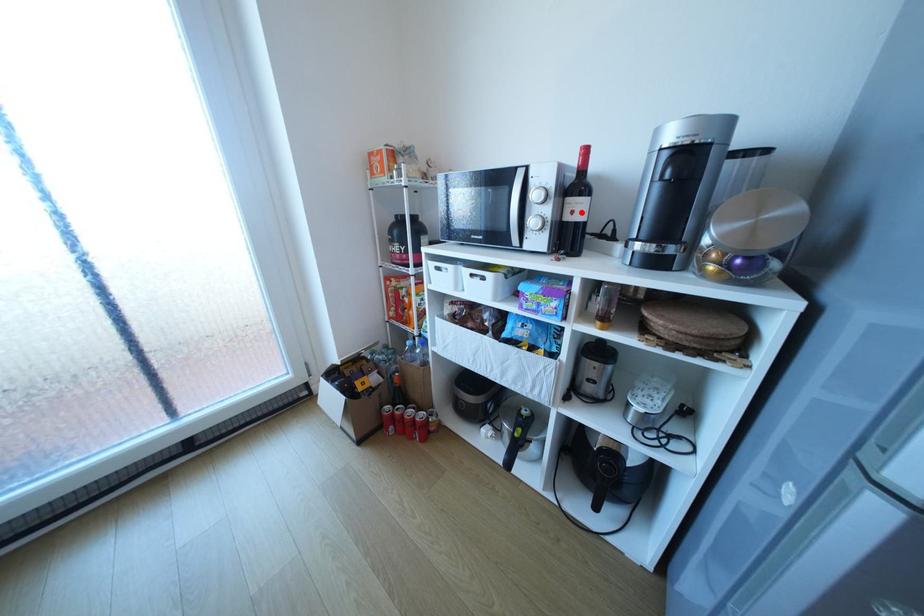
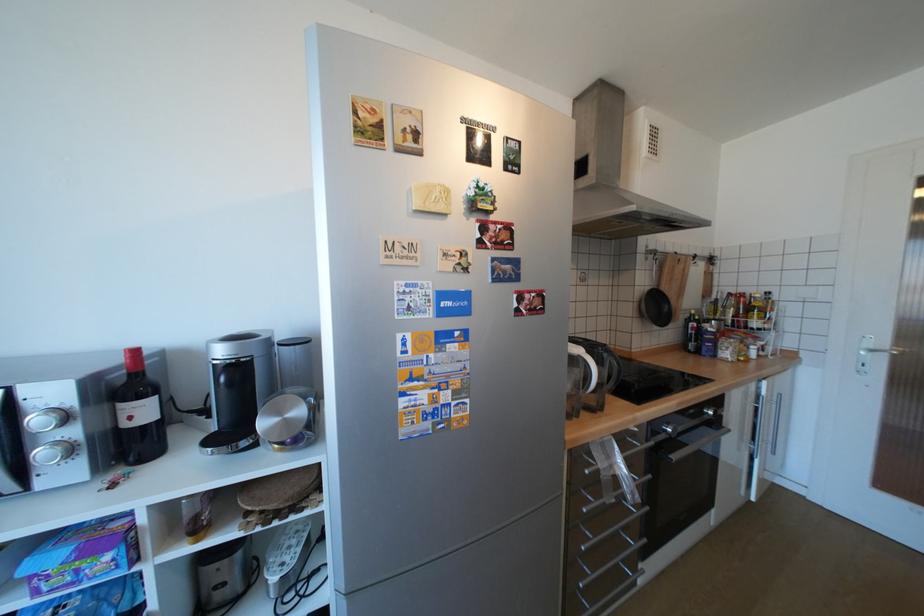
Where in the second image is the point corresponding to the highlighted location from the first image?

(140, 418)